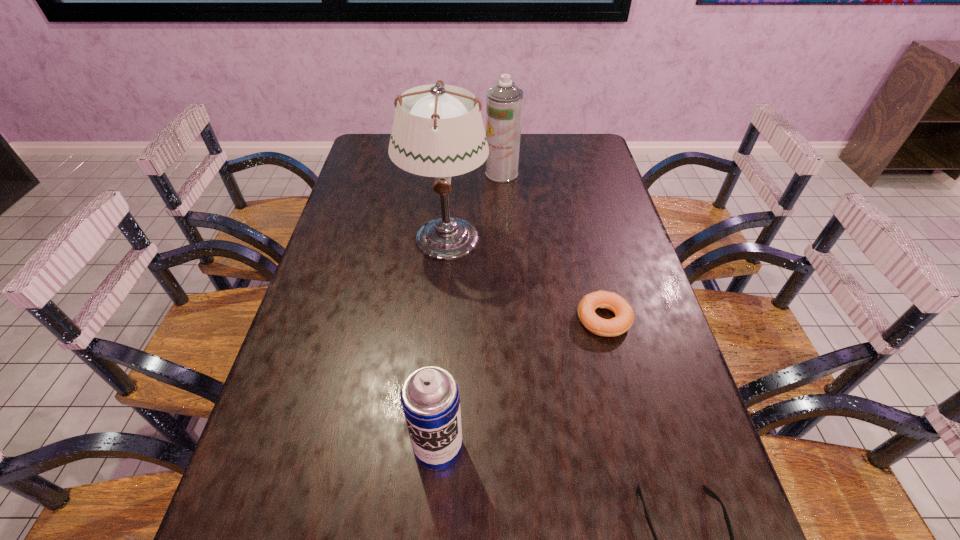
Locate an element on the screen. This screenshot has height=540, width=960. free space between the farther aerosol can and the second nearest object is located at coordinates (470, 310).

Locate an element on the screen. vacant area that lies between the tallest object and the farthest object is located at coordinates (473, 206).

At what (x,y) coordinates should I click in order to perform the action: click on unoccupied area between the second farthest object and the bagel. Please return your answer as a coordinate pair (x, y). The width and height of the screenshot is (960, 540). Looking at the image, I should click on (524, 279).

Identify the location of free spot between the shorter aerosol can and the third farthest object. Image resolution: width=960 pixels, height=540 pixels. (520, 383).

Find the location of a particular element. This screenshot has width=960, height=540. free space between the third farthest object and the farther aerosol can is located at coordinates (553, 246).

Where is `free space between the farther aerosol can and the tallest object`? free space between the farther aerosol can and the tallest object is located at coordinates (473, 206).

Where is `object that is the fourth nearest to the bagel`? This screenshot has height=540, width=960. object that is the fourth nearest to the bagel is located at coordinates (504, 103).

This screenshot has width=960, height=540. Identify the location of object that stands as the third closest to the taller aerosol can. (430, 399).

At what (x,y) coordinates should I click in order to perform the action: click on free point that satisfies the following two spatial constraints: 1. on the lampshade of the third farthest object; 2. on the right side of the second farthest object. Please return your answer as a coordinate pair (x, y). Image resolution: width=960 pixels, height=540 pixels. Looking at the image, I should click on (439, 319).